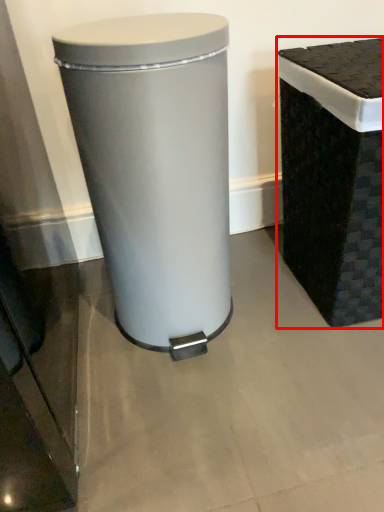
Question: Considering the relative positions of waste container (annotated by the red box) and waste container in the image provided, where is waste container (annotated by the red box) located with respect to the staircase?

Choices:
 (A) right
 (B) left

Answer: (A)